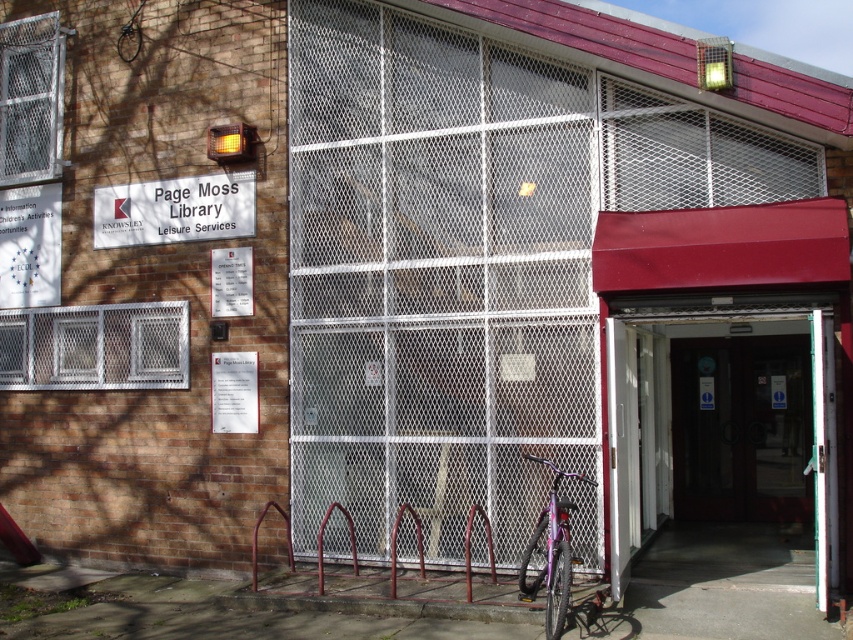
Is white plastic sign at upper left smaller than matte purple bicycle at lower center?

Indeed, white plastic sign at upper left has a smaller size compared to matte purple bicycle at lower center.

Between white plastic sign at upper left and matte purple bicycle at lower center, which one is positioned higher?

white plastic sign at upper left

This screenshot has width=853, height=640. I want to click on white plastic sign at upper left, so click(175, 209).